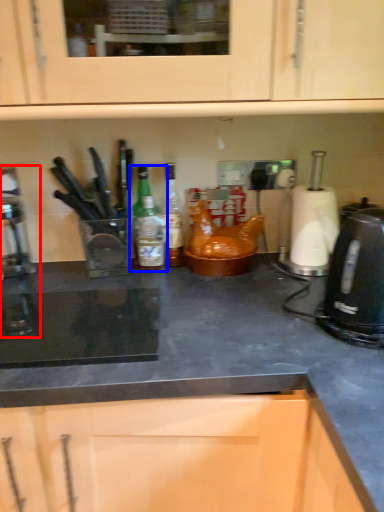
Question: Which of the following is the farthest to the observer, coffee machine (highlighted by a red box) or kitchen appliance (highlighted by a blue box)?

Choices:
 (A) coffee machine
 (B) kitchen appliance

Answer: (B)